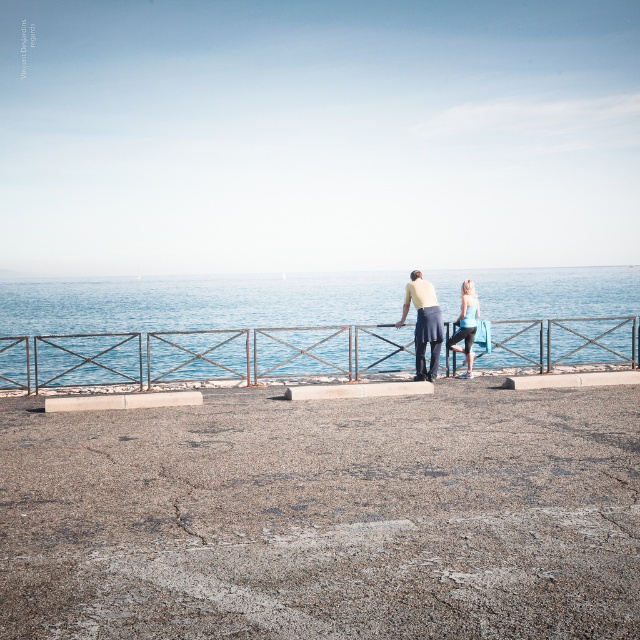
Question: Which object appears closest to the camera in this image?

Choices:
 (A) blue fabric leggings at center
 (B) smooth concrete ground at center

Answer: (B)

Question: Which point is closer to the camera?

Choices:
 (A) (83, 380)
 (B) (164, 513)
 (C) (428, 330)
 (D) (477, 307)

Answer: (B)

Question: Which is farther from the blue fabric leggings at center?

Choices:
 (A) smooth concrete ground at center
 (B) blue water at center
 (C) matte yellow shirt at center

Answer: (B)

Question: Does smooth concrete ground at center have a lesser width compared to blue fabric leggings at center?

Choices:
 (A) no
 (B) yes

Answer: (A)

Question: Does smooth concrete ground at center appear on the right side of blue fabric leggings at center?

Choices:
 (A) no
 (B) yes

Answer: (A)

Question: Does smooth concrete ground at center appear on the right side of blue fabric leggings at center?

Choices:
 (A) yes
 (B) no

Answer: (B)